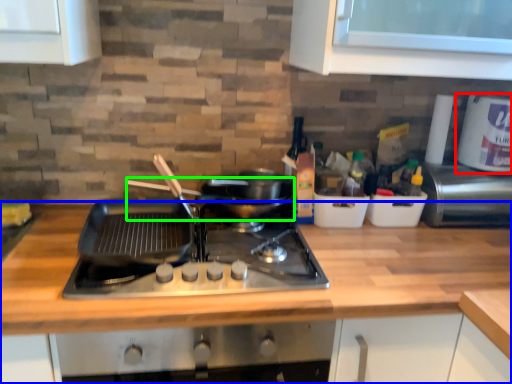
Question: Based on their relative distances, which object is farther from kitchen appliance (highlighted by a red box)? Choose from countertop (highlighted by a blue box) and wok (highlighted by a green box).

Choices:
 (A) countertop
 (B) wok

Answer: (B)